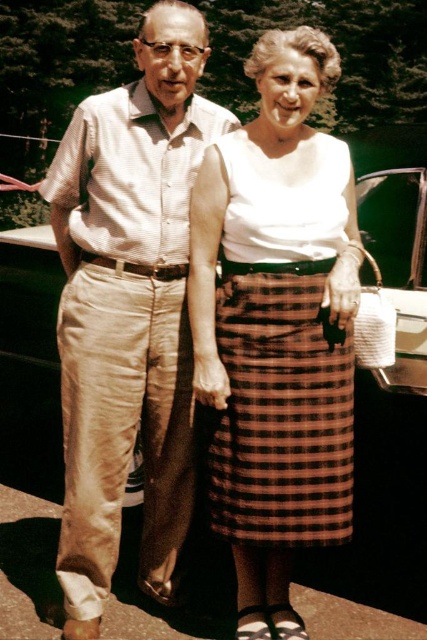
Question: Considering the relative positions of light beige cotton pants at left and brown plaid skirt at center in the image provided, where is light beige cotton pants at left located with respect to brown plaid skirt at center?

Choices:
 (A) left
 (B) right

Answer: (A)

Question: Which point is closer to the camera?

Choices:
 (A) (184, 116)
 (B) (257, 248)

Answer: (B)

Question: Which object appears closest to the camera in this image?

Choices:
 (A) brown plaid skirt at center
 (B) light beige cotton pants at left

Answer: (A)

Question: Which point is farther to the camera?

Choices:
 (A) (90, 634)
 (B) (231, 524)

Answer: (A)

Question: Can you confirm if light beige cotton pants at left is positioned to the right of brown plaid skirt at center?

Choices:
 (A) no
 (B) yes

Answer: (A)

Question: Can you confirm if light beige cotton pants at left is bigger than brown plaid skirt at center?

Choices:
 (A) yes
 (B) no

Answer: (A)